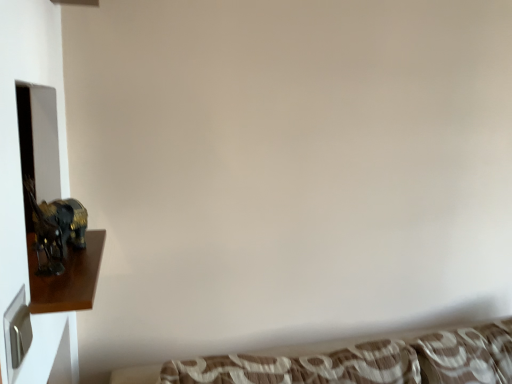
Locate an element on the screen. This screenshot has height=384, width=512. free space above shiny gold statue at left (from a real-world perspective) is located at coordinates (71, 273).